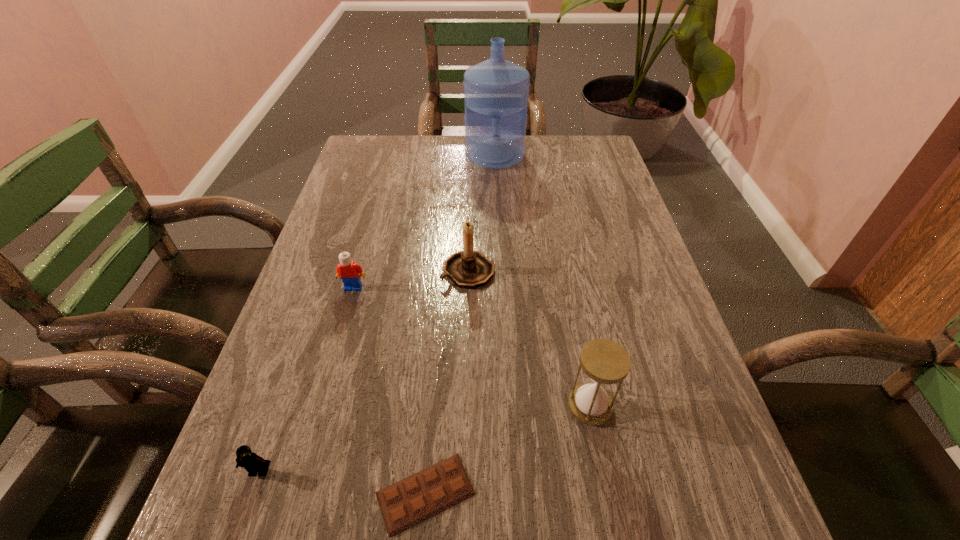
What are the coordinates of `vacant area at the right edge of the desktop` in the screenshot? It's located at (591, 280).

You are a GUI agent. You are given a task and a screenshot of the screen. Output one action in this format:
    pyautogui.click(x=<x>, y=<y>)
    Task: Click on the vacant space at the far left corner of the desktop
    This screenshot has height=540, width=960.
    Given the screenshot: What is the action you would take?
    pyautogui.click(x=360, y=140)

In the image, there is a desktop. Where is `vacant space at the far right corner`? vacant space at the far right corner is located at coordinates (570, 137).

I want to click on free spot between the taller Lego and the left Lego, so click(306, 379).

The image size is (960, 540). I want to click on vacant point located between the tallest object and the shorter Lego, so click(377, 313).

Where is `free space between the rightmost object and the candle holder`? free space between the rightmost object and the candle holder is located at coordinates (529, 339).

Locate an element on the screen. vacant region between the farther Lego and the leftmost object is located at coordinates (306, 379).

The height and width of the screenshot is (540, 960). I want to click on empty space between the water jug and the shorter Lego, so click(x=377, y=313).

The height and width of the screenshot is (540, 960). In order to click on empty space that is in between the tallest object and the left Lego in this screenshot , I will do `click(377, 313)`.

Where is `vacant area that lies between the tallest object and the fourth tallest object`? This screenshot has width=960, height=540. vacant area that lies between the tallest object and the fourth tallest object is located at coordinates (424, 221).